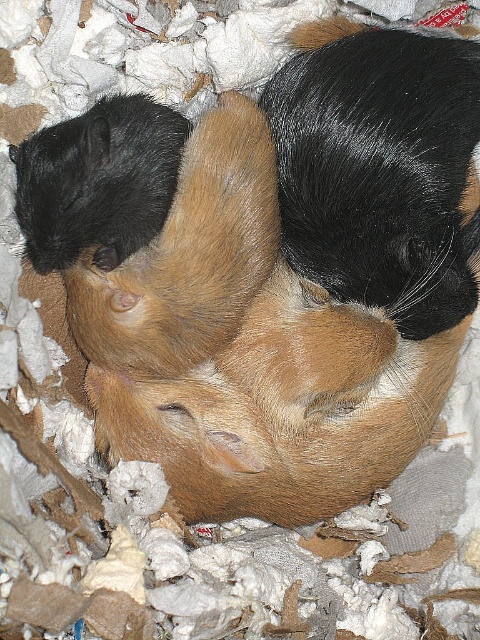
You are a veterinarian examining two guinea pigs in an enclosure. You need to separate them for a health check. Which guinea pig should you approach first to minimize disturbance, the brown fuzzy guinea pig at center or the black fuzzy guinea pig at upper left?

You should approach the black fuzzy guinea pig at upper left first because the brown fuzzy guinea pig at center is positioned on the right side of it, meaning the black one is closer to you and easier to reach without disturbing the other.

You are a veterinarian examining two guinea pigs. You need to determine which one requires a larger cage based on their size. Which guinea pig, the brown fuzzy guinea pig at center or the black fuzzy guinea pig at upper left, needs a bigger living space?

The brown fuzzy guinea pig at center needs a bigger living space because it is taller than the black fuzzy guinea pig at upper left.

You are a photographer aiming to capture a closeup shot of the guinea pigs. You have two focal points to choose from, point [146,344] and point [156,216]. Which point is closer to you and would provide a clearer focus for the foreground?

Point [146,344] is further to the viewer than point [156,216], so the point [156,216] is closer and would provide a clearer focus for the foreground.